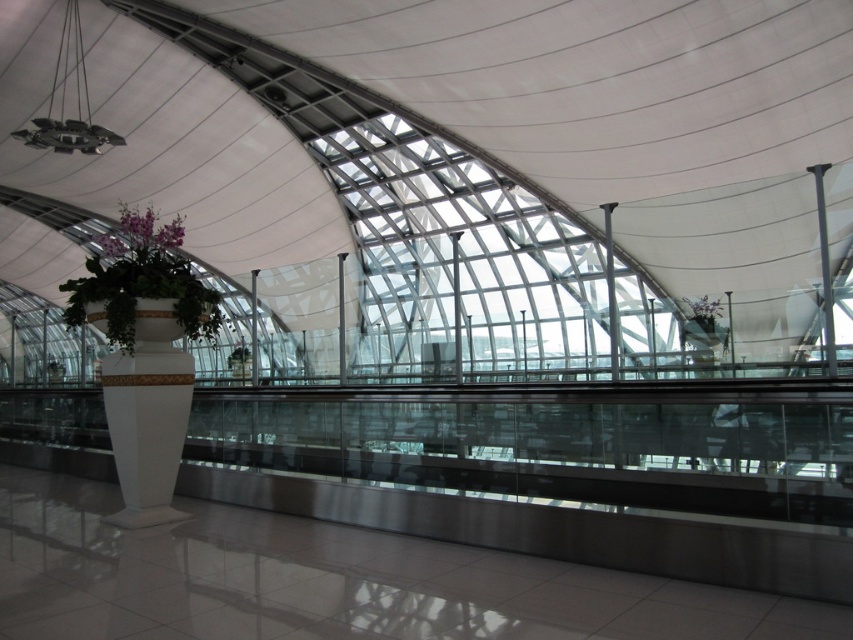
In the scene shown: Does white glossy planter at center appear on the right side of purple matte flower at upper right?

In fact, white glossy planter at center is to the left of purple matte flower at upper right.

Does white glossy planter at center lie in front of purple matte flower at upper right?

Yes.

Is point (126, 321) behind point (695, 300)?

No, it is not.

Find the location of `white glossy planter at center`. white glossy planter at center is located at coordinates (141, 282).

Does white glossy planter at center appear on the right side of purple matte orchid at upper left?

Incorrect, white glossy planter at center is not on the right side of purple matte orchid at upper left.

Looking at this image, does white glossy planter at center have a lesser height compared to purple matte orchid at upper left?

In fact, white glossy planter at center may be taller than purple matte orchid at upper left.

Between point (120, 294) and point (132, 211), which one is positioned in front?

Point (120, 294)

Identify the location of white glossy planter at center. (141, 282).

Is white glossy pillar at center thinner than purple matte orchid at upper left?

Yes, white glossy pillar at center is thinner than purple matte orchid at upper left.

What do you see at coordinates (148, 413) in the screenshot?
I see `white glossy pillar at center` at bounding box center [148, 413].

Where is `white glossy pillar at center`? Image resolution: width=853 pixels, height=640 pixels. white glossy pillar at center is located at coordinates (148, 413).